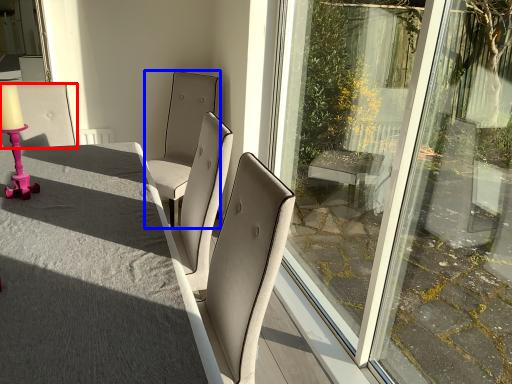
Question: Among these objects, which one is nearest to the camera, chair (highlighted by a red box) or chair (highlighted by a blue box)?

Choices:
 (A) chair
 (B) chair

Answer: (A)